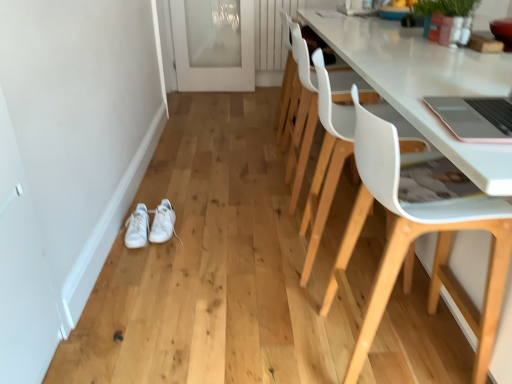
Question: Should I look upward or downward to see white plastic chair at center, positioned as the third chair in front-to-back order?

Choices:
 (A) down
 (B) up

Answer: (B)

Question: Considering the relative sizes of white leather sneakers at lower left, which is counted as the first footwear, starting from the left, and white plastic chair at right, which appears as the 2th chair when viewed from the front, in the image provided, is white leather sneakers at lower left, which is counted as the first footwear, starting from the left, thinner than white plastic chair at right, which appears as the 2th chair when viewed from the front,?

Choices:
 (A) no
 (B) yes

Answer: (B)

Question: Considering the relative sizes of white leather sneakers at lower left, which is counted as the first footwear, starting from the left, and white plastic chair at right, which appears as the 2th chair when viewed from the front, in the image provided, is white leather sneakers at lower left, which is counted as the first footwear, starting from the left, taller than white plastic chair at right, which appears as the 2th chair when viewed from the front,?

Choices:
 (A) no
 (B) yes

Answer: (A)

Question: From the image's perspective, is white leather sneakers at lower left, the second footwear from the right, on white plastic chair at right, which appears as the 2th chair when viewed from the front?

Choices:
 (A) no
 (B) yes

Answer: (A)

Question: Considering the relative positions of white leather sneakers at lower left, which is counted as the first footwear, starting from the left, and white plastic chair at right, which appears as the 2th chair when viewed from the front, in the image provided, is white leather sneakers at lower left, which is counted as the first footwear, starting from the left, to the left of white plastic chair at right, which appears as the 2th chair when viewed from the front, from the viewer's perspective?

Choices:
 (A) no
 (B) yes

Answer: (B)

Question: Does white leather sneakers at lower left, the second footwear from the right, contain white plastic chair at right, marked as the second chair in a back-to-front arrangement?

Choices:
 (A) no
 (B) yes

Answer: (A)

Question: Is white leather sneakers at lower left, the second footwear from the right, smaller than white plastic chair at right, marked as the second chair in a back-to-front arrangement?

Choices:
 (A) yes
 (B) no

Answer: (A)

Question: Is the depth of white plastic chair at right, the first chair in the front-to-back sequence, less than that of white leather sneakers at lower left, which is counted as the 1th footwear, starting from the right?

Choices:
 (A) yes
 (B) no

Answer: (A)

Question: Is white plastic chair at right, the first chair in the front-to-back sequence, thinner than white leather sneakers at lower left, which is counted as the 1th footwear, starting from the right?

Choices:
 (A) yes
 (B) no

Answer: (B)

Question: Can you confirm if white plastic chair at right, which is the 3th chair in back-to-front order, is bigger than white leather sneakers at lower left, which is counted as the 1th footwear, starting from the right?

Choices:
 (A) yes
 (B) no

Answer: (A)

Question: Does white plastic chair at right, the first chair in the front-to-back sequence, come behind white leather sneakers at lower left, marked as the 2th footwear in a left-to-right arrangement?

Choices:
 (A) yes
 (B) no

Answer: (B)

Question: From the image's perspective, is white plastic chair at right, which is the 3th chair in back-to-front order, below white leather sneakers at lower left, marked as the 2th footwear in a left-to-right arrangement?

Choices:
 (A) no
 (B) yes

Answer: (B)

Question: From a real-world perspective, is white plastic chair at right, the first chair in the front-to-back sequence, over white leather sneakers at lower left, which is counted as the 1th footwear, starting from the right?

Choices:
 (A) no
 (B) yes

Answer: (B)

Question: From a real-world perspective, is white leather sneakers at lower left, which is counted as the 1th footwear, starting from the right, positioned under white leather sneakers at lower left, the second footwear from the right, based on gravity?

Choices:
 (A) yes
 (B) no

Answer: (B)